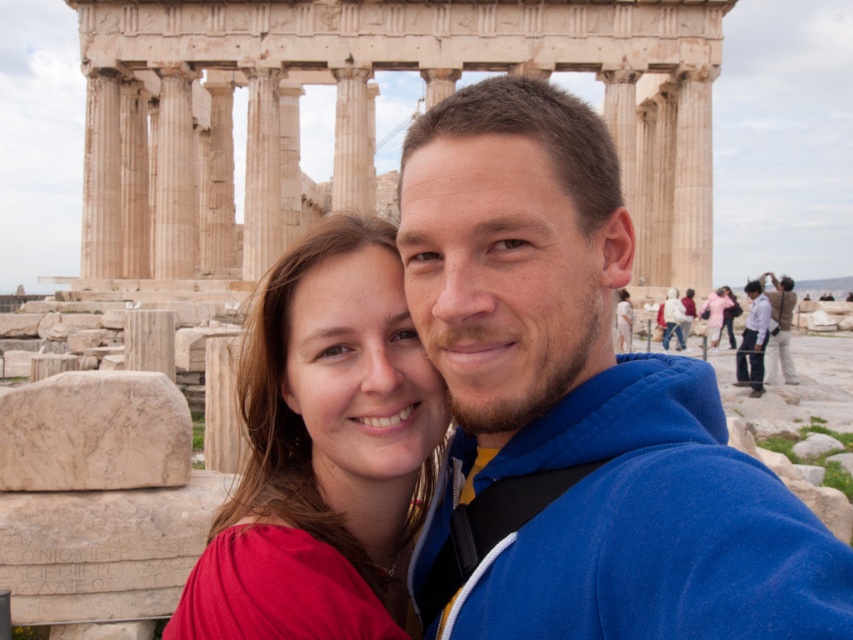
Who is positioned more to the right, blue fleece jacket at center or light blue shirt at center?

From the viewer's perspective, light blue shirt at center appears more on the right side.

The height and width of the screenshot is (640, 853). I want to click on blue fleece jacket at center, so click(x=577, y=408).

This screenshot has width=853, height=640. Identify the location of blue fleece jacket at center. tap(577, 408).

Is matte red dress at center to the left of light brown leather jacket at right from the viewer's perspective?

Indeed, matte red dress at center is positioned on the left side of light brown leather jacket at right.

Who is higher up, matte red dress at center or light brown leather jacket at right?

light brown leather jacket at right is above.

Describe the element at coordinates (323, 451) in the screenshot. This screenshot has width=853, height=640. I see `matte red dress at center` at that location.

I want to click on matte red dress at center, so click(323, 451).

Which is behind, point (479, 468) or point (792, 381)?

The point (792, 381) is more distant.

What are the coordinates of `blue fleece jacket at center` in the screenshot? It's located at (577, 408).